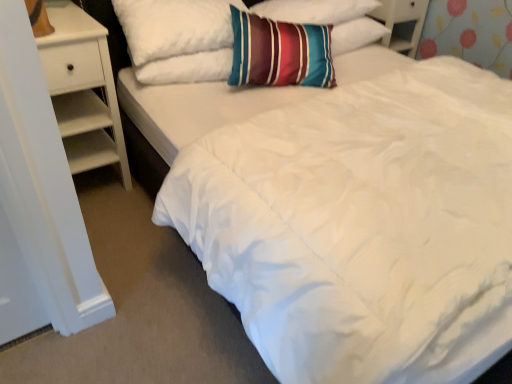
Question: From the image's perspective, is white wood nightstand at left above striped fabric pillow at upper center, which is counted as the second pillow, starting from the right?

Choices:
 (A) no
 (B) yes

Answer: (A)

Question: Is white wood nightstand at left facing towards striped fabric pillow at upper center, which is the 1th pillow from left to right?

Choices:
 (A) no
 (B) yes

Answer: (A)

Question: Is white wood nightstand at left at the left side of striped fabric pillow at upper center, which is the 1th pillow from left to right?

Choices:
 (A) no
 (B) yes

Answer: (B)

Question: From the image's perspective, is white wood nightstand at left located beneath striped fabric pillow at upper center, which is the 1th pillow from left to right?

Choices:
 (A) yes
 (B) no

Answer: (A)

Question: Is white wood nightstand at left turned away from striped fabric pillow at upper center, which is counted as the second pillow, starting from the right?

Choices:
 (A) yes
 (B) no

Answer: (B)

Question: Is striped cotton pillow at center, positioned as the second pillow in left-to-right order, bigger or smaller than white wood dresser at upper right?

Choices:
 (A) big
 (B) small

Answer: (B)

Question: From a real-world perspective, is striped cotton pillow at center, positioned as the second pillow in left-to-right order, positioned above or below white wood dresser at upper right?

Choices:
 (A) above
 (B) below

Answer: (A)

Question: From the image's perspective, relative to white wood dresser at upper right, is striped cotton pillow at center, the 1th pillow in the right-to-left sequence, above or below?

Choices:
 (A) above
 (B) below

Answer: (B)

Question: Is striped cotton pillow at center, positioned as the second pillow in left-to-right order, in front of or behind white wood dresser at upper right in the image?

Choices:
 (A) front
 (B) behind

Answer: (A)

Question: Considering the positions of striped fabric pillow at upper center, which is counted as the second pillow, starting from the right, and white wood dresser at upper right in the image, is striped fabric pillow at upper center, which is counted as the second pillow, starting from the right, bigger or smaller than white wood dresser at upper right?

Choices:
 (A) big
 (B) small

Answer: (A)

Question: From a real-world perspective, relative to white wood dresser at upper right, is striped fabric pillow at upper center, which is the 1th pillow from left to right, vertically above or below?

Choices:
 (A) above
 (B) below

Answer: (A)

Question: In terms of height, does striped fabric pillow at upper center, which is the 1th pillow from left to right, look taller or shorter compared to white wood dresser at upper right?

Choices:
 (A) short
 (B) tall

Answer: (B)

Question: Relative to white wood dresser at upper right, is striped fabric pillow at upper center, which is counted as the second pillow, starting from the right, in front or behind?

Choices:
 (A) behind
 (B) front

Answer: (B)

Question: In terms of height, does white wood nightstand at left look taller or shorter compared to striped fabric pillow at upper center, which is the 1th pillow from left to right?

Choices:
 (A) short
 (B) tall

Answer: (B)

Question: Is white wood nightstand at left wider or thinner than striped fabric pillow at upper center, which is the 1th pillow from left to right?

Choices:
 (A) wide
 (B) thin

Answer: (A)